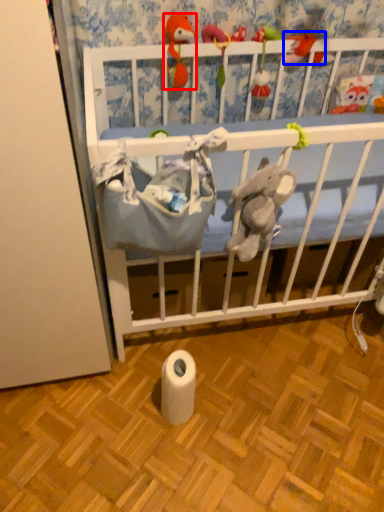
Question: Which object is further to the camera taking this photo, toy (highlighted by a red box) or toy (highlighted by a blue box)?

Choices:
 (A) toy
 (B) toy

Answer: (B)